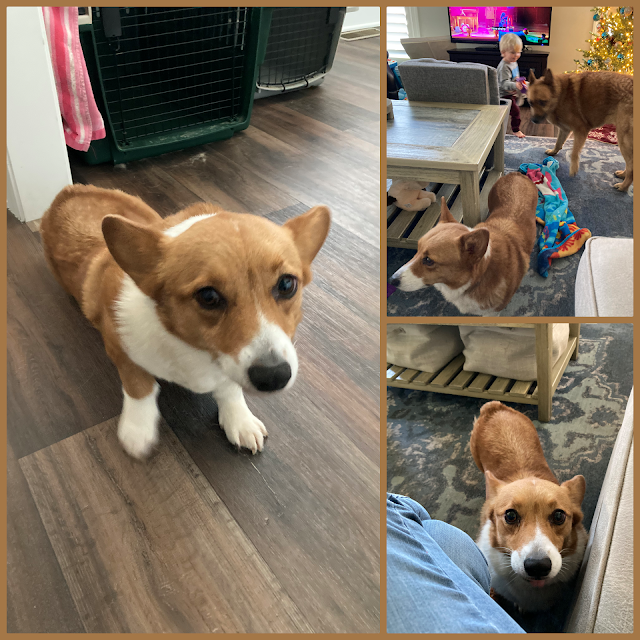
Find the location of `blanket`. blanket is located at coordinates (550, 196).